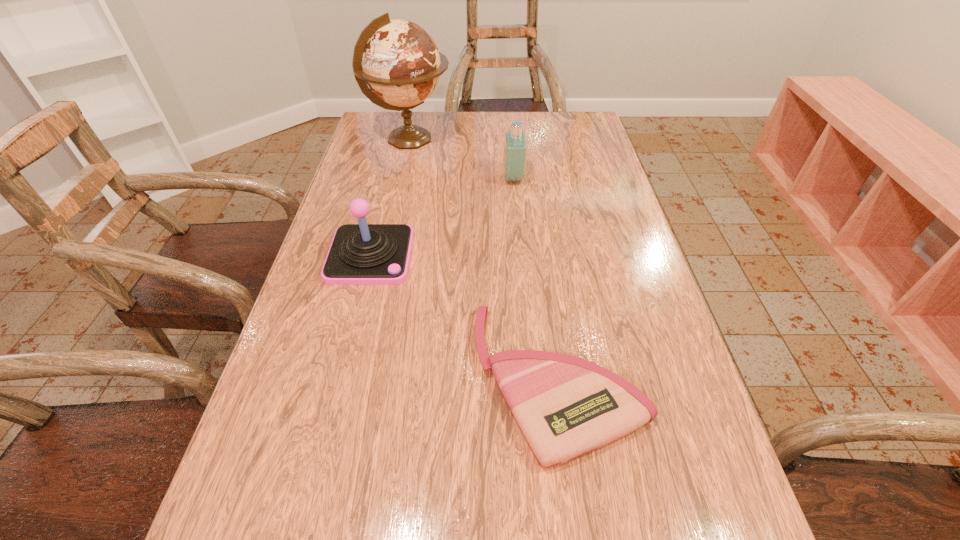
The image size is (960, 540). What are the coordinates of `free space that satisfies the following two spatial constraints: 1. on the front of the globe showing Asia; 2. on the left side of the shortest object` in the screenshot? It's located at (357, 380).

Identify the location of vacant space that satisfies the following two spatial constraints: 1. on the front of the tallest object showing Asia; 2. on the right side of the nearest object. This screenshot has width=960, height=540. (357, 380).

In order to click on vacant space that satisfies the following two spatial constraints: 1. forward from the base of the shortest object; 2. on the left side of the third farthest object in this screenshot , I will do `click(339, 380)`.

At what (x,y) coordinates should I click in order to perform the action: click on blank area in the image that satisfies the following two spatial constraints: 1. forward from the base of the shortest object; 2. on the right side of the second nearest object. Please return your answer as a coordinate pair (x, y). This screenshot has height=540, width=960. Looking at the image, I should click on (339, 380).

You are a GUI agent. You are given a task and a screenshot of the screen. Output one action in this format:
    pyautogui.click(x=<x>, y=<y>)
    Task: Click on the vacant position in the image that satisfies the following two spatial constraints: 1. on the front label of the third nearest object; 2. on the right side of the shortest object
    This screenshot has height=540, width=960.
    Given the screenshot: What is the action you would take?
    pyautogui.click(x=532, y=380)